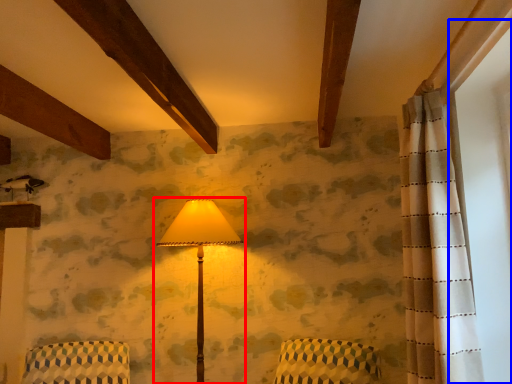
Question: Which of the following is the farthest to the observer, lamp (highlighted by a red box) or window screen (highlighted by a blue box)?

Choices:
 (A) lamp
 (B) window screen

Answer: (A)